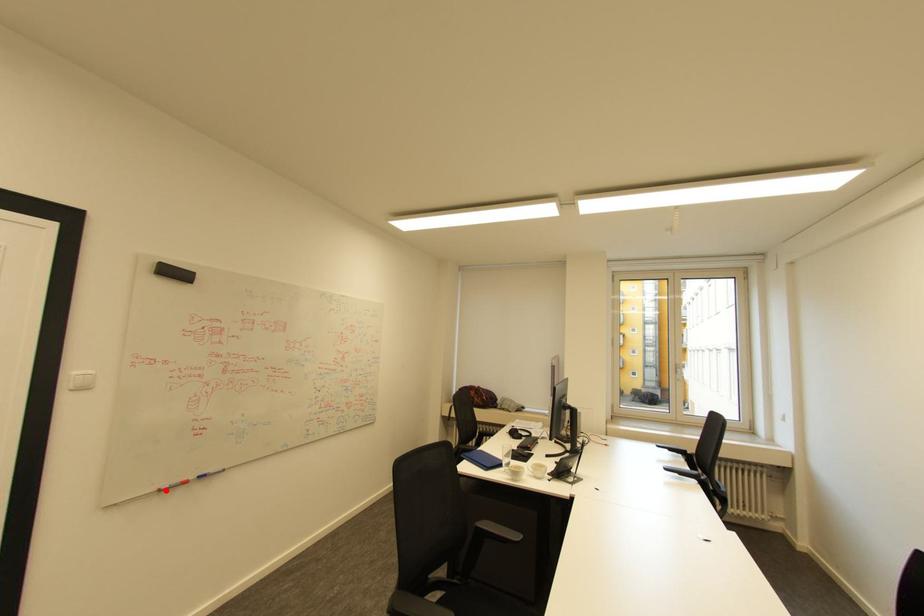
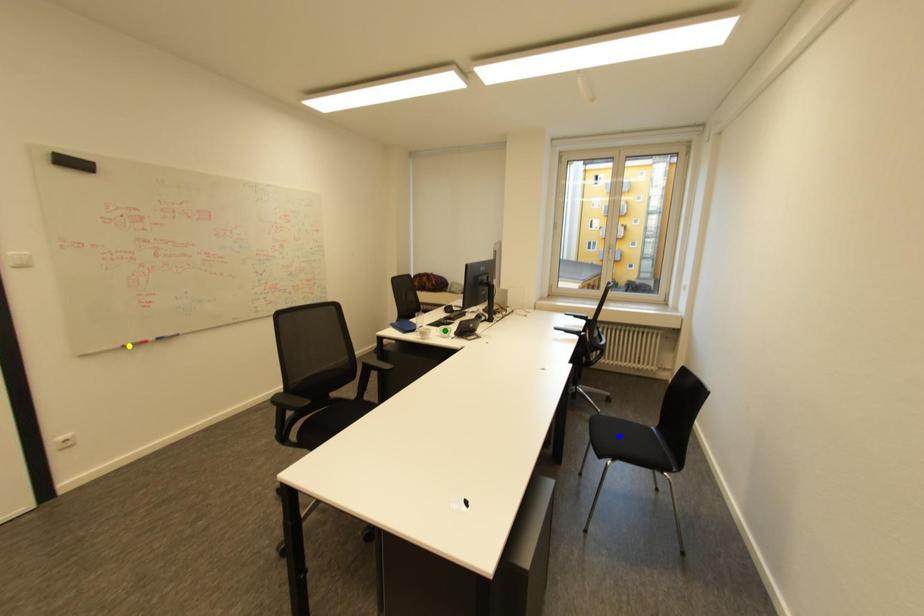
Question: I am providing you with two images of the same scene from different viewpoints. A red point is marked on the first image. You are given multiple points on the second image. Which spot in image 2 lines up with the point in image 1?

Choices:
 (A) blue point
 (B) yellow point
 (C) green point

Answer: (B)